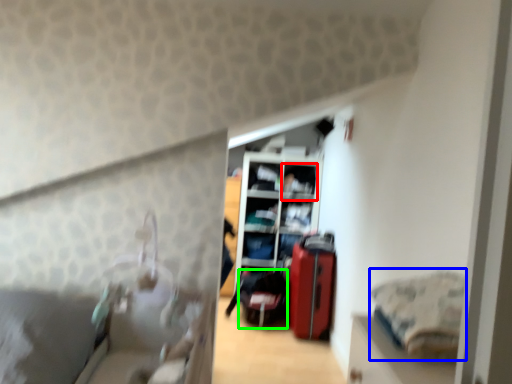
Question: Which object is the closest to the shelf (highlighted by a red box)? Choose among these: bedding (highlighted by a blue box) or luggage (highlighted by a green box).

Choices:
 (A) bedding
 (B) luggage

Answer: (B)